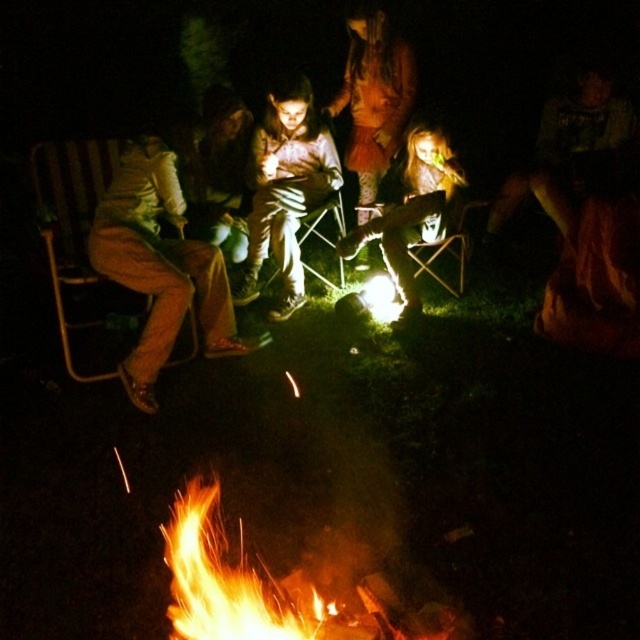
Between matte brown jacket at center and wooden chair at left, which one is positioned lower?

wooden chair at left

How far apart are matte brown jacket at center and wooden chair at left?

matte brown jacket at center and wooden chair at left are 1.21 meters apart.

What do you see at coordinates (285, 188) in the screenshot?
I see `matte brown jacket at center` at bounding box center [285, 188].

Locate an element on the screen. This screenshot has height=640, width=640. matte brown jacket at center is located at coordinates (285, 188).

Consider the image. Between matte brown pants at left and matte black jacket at center, which one appears on the right side from the viewer's perspective?

matte black jacket at center

Describe the element at coordinates (161, 266) in the screenshot. I see `matte brown pants at left` at that location.

Where is `matte brown pants at left`? The image size is (640, 640). matte brown pants at left is located at coordinates pyautogui.click(x=161, y=266).

Who is taller, matte brown pants at left or wooden chair at left?

matte brown pants at left

Is matte brown pants at left positioned before wooden chair at left?

No.

Between point (150, 326) and point (61, 216), which one is positioned behind?

The point (61, 216) is behind.

Image resolution: width=640 pixels, height=640 pixels. I want to click on matte brown pants at left, so [161, 266].